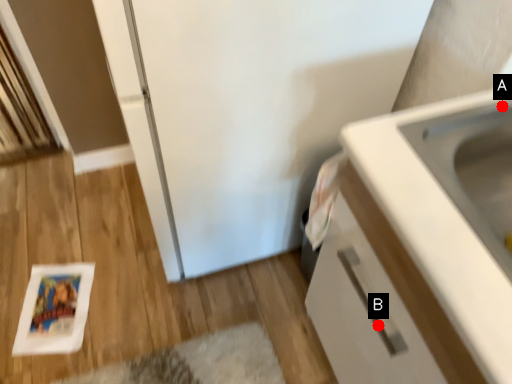
Question: Two points are circled on the image, labeled by A and B beside each circle. Which point is closer to the camera?

Choices:
 (A) A is closer
 (B) B is closer

Answer: (A)